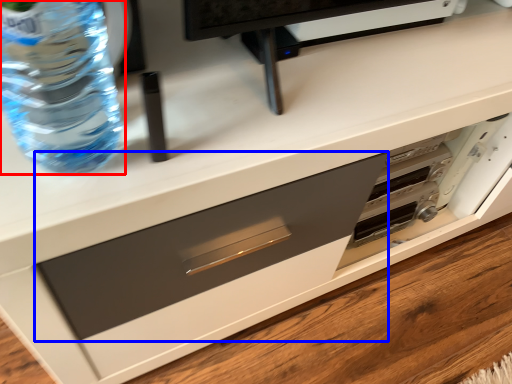
Question: Which point is closer to the camera, bottle (highlighted by a red box) or drawer (highlighted by a blue box)?

Choices:
 (A) bottle
 (B) drawer

Answer: (A)